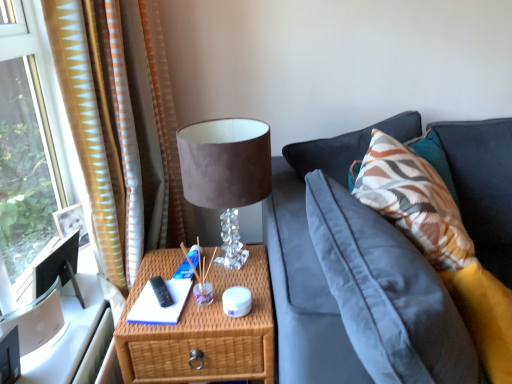
Find the location of a particular element. The width and height of the screenshot is (512, 384). vacant space behind white paper at center is located at coordinates (173, 266).